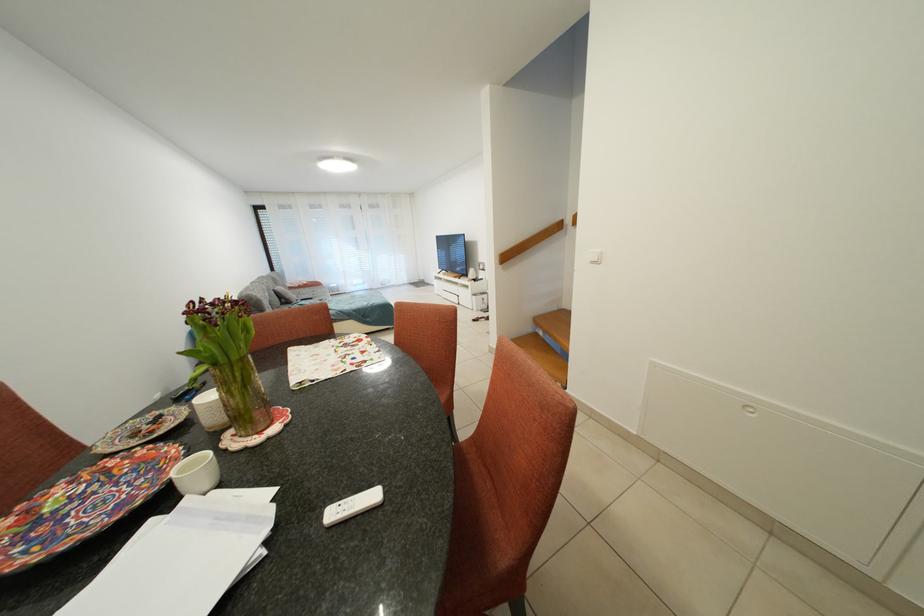
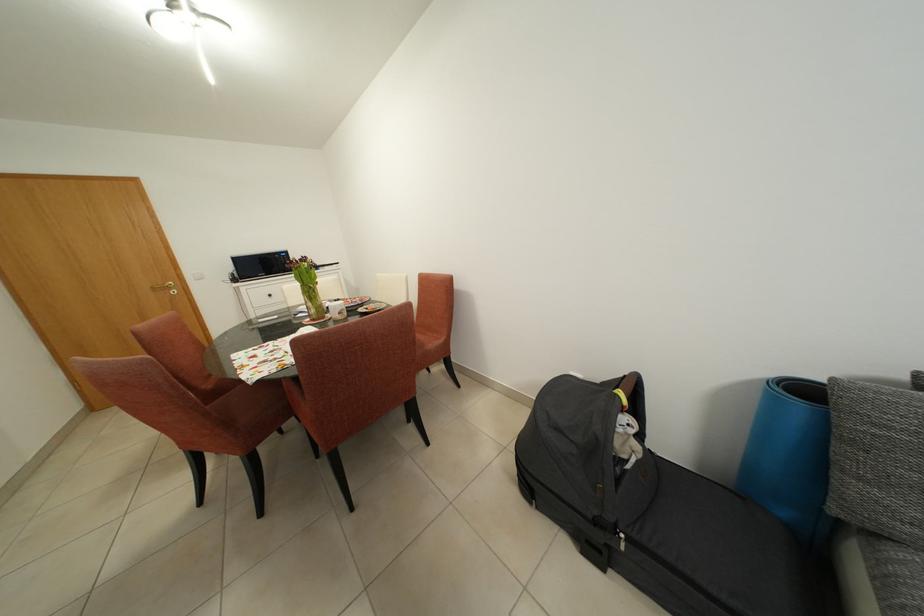
In the second image, find the point that corresponds to [223,369] in the first image.

(319, 286)